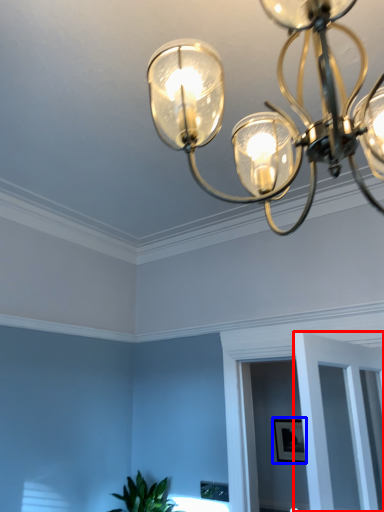
Question: Which of the following is the closest to the observer, glass door (highlighted by a red box) or picture frame (highlighted by a blue box)?

Choices:
 (A) glass door
 (B) picture frame

Answer: (A)